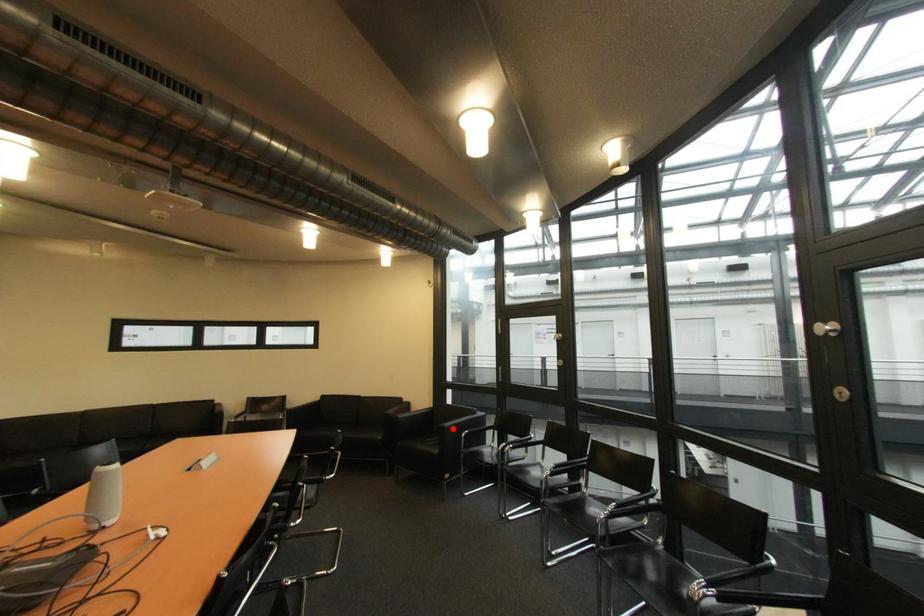
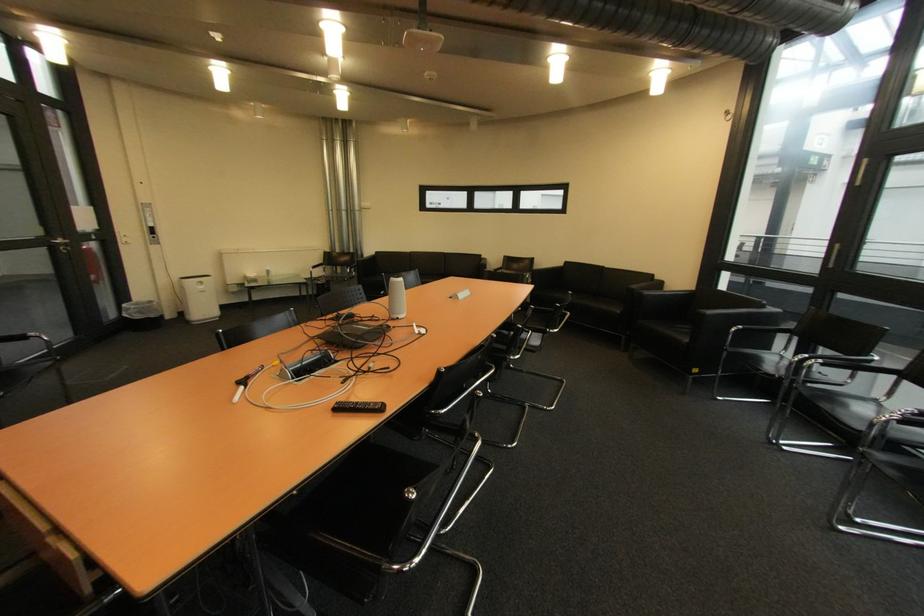
In the second image, find the point that corresponds to the highlighted location in the first image.

(712, 315)